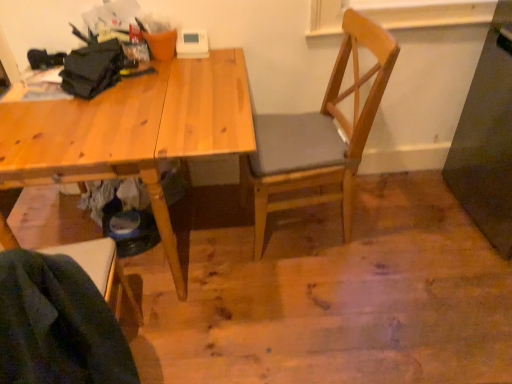
Image resolution: width=512 pixels, height=384 pixels. Identify the location of free space between wooden chair at center, arranged as the 1th chair when viewed from the back, and natural wood desk at upper left. (295, 263).